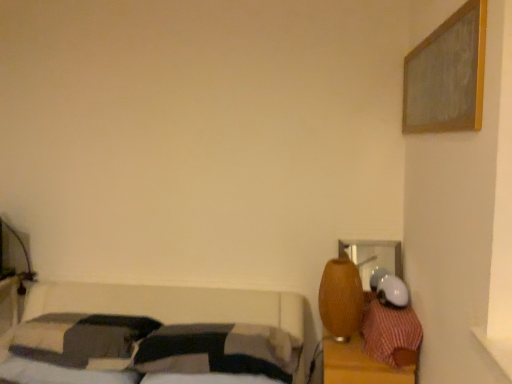
Question: From a real-world perspective, is wooden dresser at right physically above braided wood table lamp at right?

Choices:
 (A) yes
 (B) no

Answer: (B)

Question: From the image's perspective, does wooden dresser at right appear higher than braided wood table lamp at right?

Choices:
 (A) yes
 (B) no

Answer: (B)

Question: Is wooden dresser at right with braided wood table lamp at right?

Choices:
 (A) no
 (B) yes

Answer: (A)

Question: Is wooden dresser at right at the left side of braided wood table lamp at right?

Choices:
 (A) no
 (B) yes

Answer: (A)

Question: Is wooden dresser at right shorter than braided wood table lamp at right?

Choices:
 (A) no
 (B) yes

Answer: (A)

Question: Is wooden dresser at right located outside braided wood table lamp at right?

Choices:
 (A) yes
 (B) no

Answer: (A)

Question: From a real-world perspective, does soft cotton pillow at center, marked as the 2th pillow in a left-to-right arrangement, stand above wooden dresser at right?

Choices:
 (A) no
 (B) yes

Answer: (B)

Question: Are soft cotton pillow at center, marked as the 2th pillow in a left-to-right arrangement, and wooden dresser at right making contact?

Choices:
 (A) no
 (B) yes

Answer: (A)

Question: Is soft cotton pillow at center, positioned as the second pillow in right-to-left order, at the left side of wooden dresser at right?

Choices:
 (A) yes
 (B) no

Answer: (A)

Question: Is the position of soft cotton pillow at center, marked as the 2th pillow in a left-to-right arrangement, less distant than that of wooden dresser at right?

Choices:
 (A) yes
 (B) no

Answer: (A)

Question: From the image's perspective, is soft cotton pillow at center, positioned as the second pillow in right-to-left order, beneath wooden dresser at right?

Choices:
 (A) yes
 (B) no

Answer: (B)

Question: Is soft cotton pillow at center, positioned as the second pillow in right-to-left order, facing away from wooden dresser at right?

Choices:
 (A) no
 (B) yes

Answer: (A)

Question: Is the depth of braided wood table lamp at right greater than that of soft cotton pillow at center, marked as the 2th pillow in a left-to-right arrangement?

Choices:
 (A) no
 (B) yes

Answer: (B)